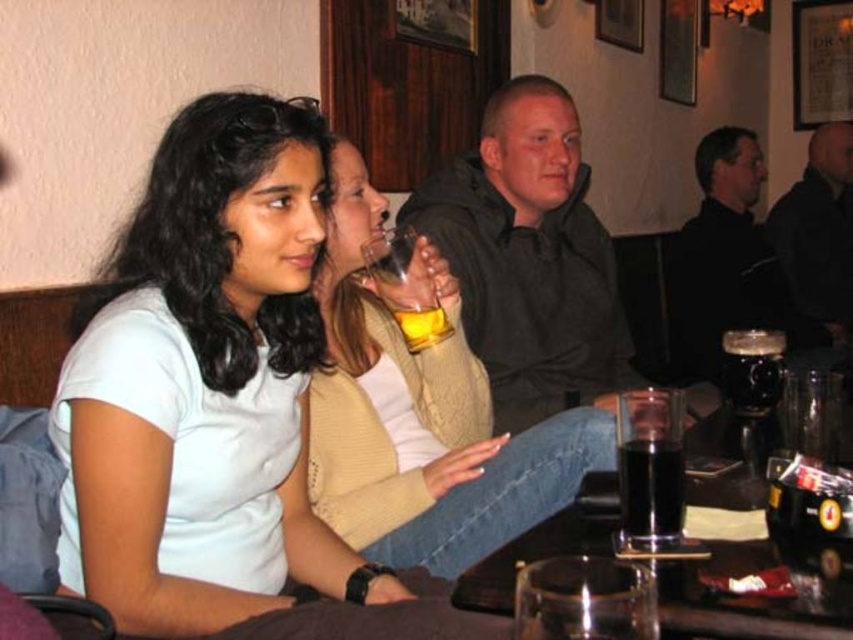
You are standing at the location of the point labeled as point (149, 500) in the image. You want to greet someone who is exactly 3.57 feet away from you. Can you greet them without moving from your current position?

Yes, because the distance between point (149, 500) and the viewer is exactly 3.57 feet, so you can greet them without moving.

What is the 2D coordinate of the knitted beige sweater at center?

The knitted beige sweater at center is located at the 2D coordinate point of [422,417].

You are a bartender at the bar and need to deliver a drink to the table. The black matte jacket at upper right and the dark glass at lower center are both at the table. How far apart are they?

The black matte jacket at upper right is 3.19 meters from the dark glass at lower center.